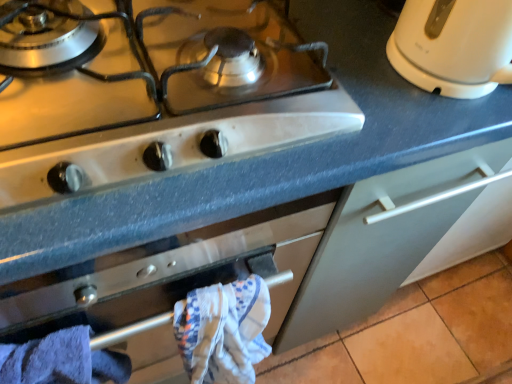
Question: Does white glossy gas stove at upper left come in front of blue cotton bath towel at lower left, which appears as the second bath towel when viewed from the right?

Choices:
 (A) no
 (B) yes

Answer: (B)

Question: Is blue cotton bath towel at lower left, which appears as the second bath towel when viewed from the right, at the back of white glossy gas stove at upper left?

Choices:
 (A) no
 (B) yes

Answer: (A)

Question: Is blue cotton bath towel at lower left, placed as the first bath towel when sorted from left to right, surrounded by white glossy gas stove at upper left?

Choices:
 (A) no
 (B) yes

Answer: (A)

Question: Is white glossy gas stove at upper left smaller than blue cotton bath towel at lower left, placed as the first bath towel when sorted from left to right?

Choices:
 (A) no
 (B) yes

Answer: (A)

Question: Would you say white glossy gas stove at upper left is outside blue cotton bath towel at lower left, placed as the first bath towel when sorted from left to right?

Choices:
 (A) no
 (B) yes

Answer: (B)

Question: In terms of size, does blue cotton bath towel at lower left, placed as the first bath towel when sorted from left to right, appear bigger or smaller than white glossy gas stove at upper left?

Choices:
 (A) small
 (B) big

Answer: (A)

Question: From a real-world perspective, is blue cotton bath towel at lower left, which appears as the second bath towel when viewed from the right, physically located above or below white glossy gas stove at upper left?

Choices:
 (A) below
 (B) above

Answer: (A)

Question: Considering their positions, is blue cotton bath towel at lower left, placed as the first bath towel when sorted from left to right, located in front of or behind white glossy gas stove at upper left?

Choices:
 (A) front
 (B) behind

Answer: (B)

Question: From the image's perspective, is blue cotton bath towel at lower left, placed as the first bath towel when sorted from left to right, positioned above or below white glossy gas stove at upper left?

Choices:
 (A) above
 (B) below

Answer: (B)

Question: From a real-world perspective, is white glossy electric kettle at upper right physically located above or below blue cotton bath towel at lower left, placed as the first bath towel when sorted from left to right?

Choices:
 (A) below
 (B) above

Answer: (B)

Question: In terms of size, does white glossy electric kettle at upper right appear bigger or smaller than blue cotton bath towel at lower left, placed as the first bath towel when sorted from left to right?

Choices:
 (A) small
 (B) big

Answer: (A)

Question: Is white glossy electric kettle at upper right inside the boundaries of blue cotton bath towel at lower left, placed as the first bath towel when sorted from left to right, or outside?

Choices:
 (A) inside
 (B) outside

Answer: (B)

Question: Is white glossy electric kettle at upper right wider or thinner than blue cotton bath towel at lower left, placed as the first bath towel when sorted from left to right?

Choices:
 (A) thin
 (B) wide

Answer: (B)

Question: Is white glossy gas stove at upper left taller or shorter than blue cotton bath towel at lower left, placed as the first bath towel when sorted from left to right?

Choices:
 (A) short
 (B) tall

Answer: (A)

Question: Is white glossy gas stove at upper left wider or thinner than blue cotton bath towel at lower left, placed as the first bath towel when sorted from left to right?

Choices:
 (A) thin
 (B) wide

Answer: (B)